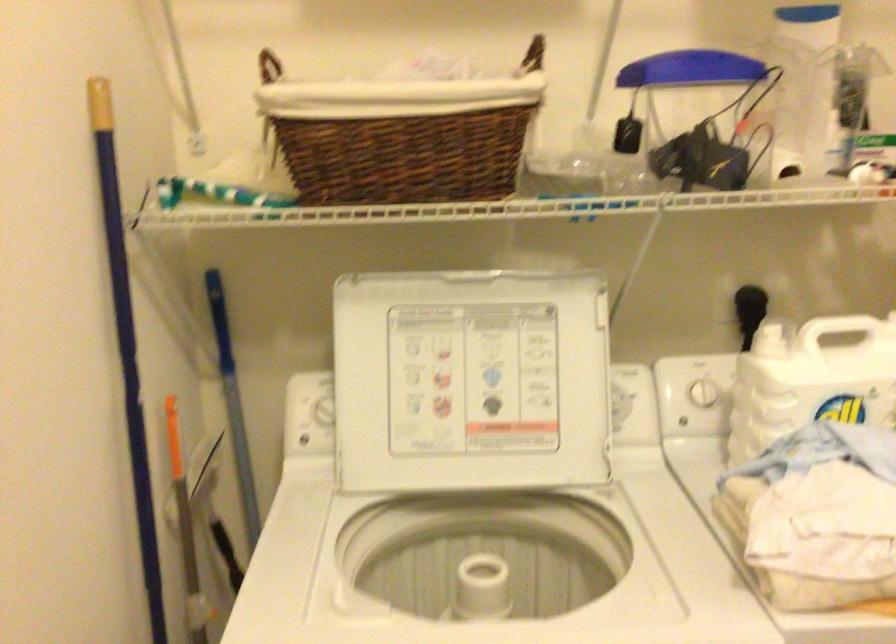
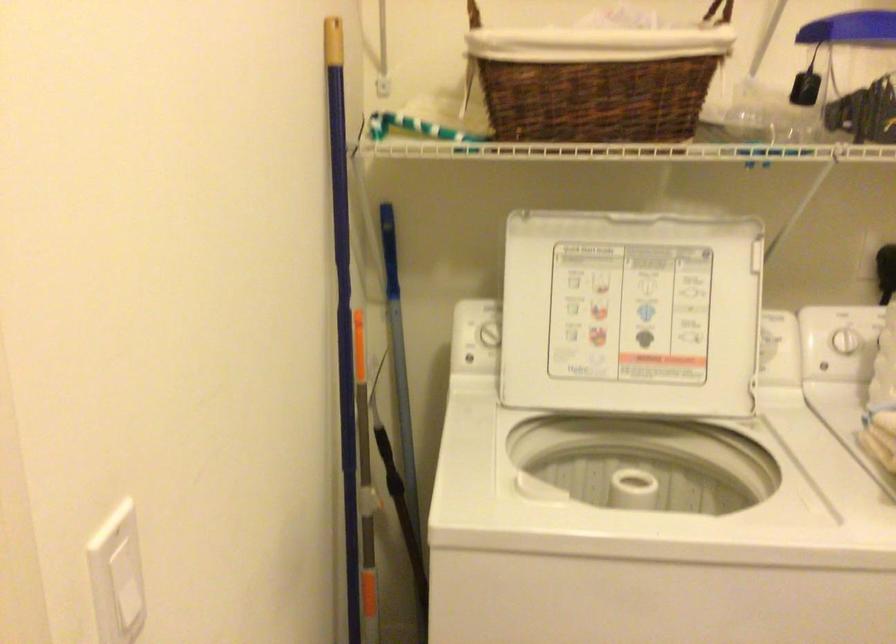
Question: Based on the continuous images, in which direction is the camera rotating? Reply with the corresponding letter.

Choices:
 (A) Left
 (B) Right
 (C) Up
 (D) Down

Answer: (A)